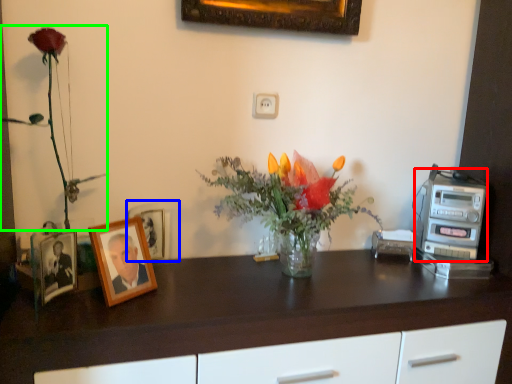
Question: Based on their relative distances, which object is farther from appliance (highlighted by a red box)? Choose from picture frame (highlighted by a blue box) and floral arrangement (highlighted by a green box).

Choices:
 (A) picture frame
 (B) floral arrangement

Answer: (B)